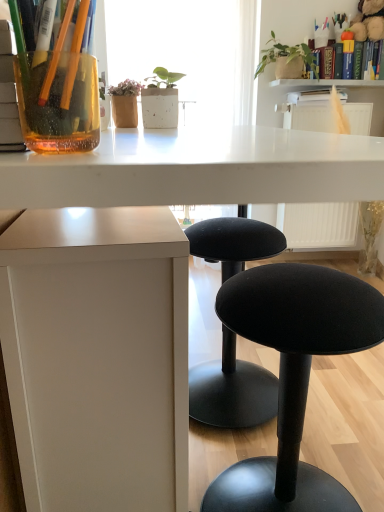
Question: Should I look upward or downward to see hardcover book at upper right, the 2th book positioned from the bottom?

Choices:
 (A) up
 (B) down

Answer: (A)

Question: From the image's perspective, is white plastic radiator at upper right on green matte plant at upper right?

Choices:
 (A) yes
 (B) no

Answer: (B)

Question: Does white plastic radiator at upper right have a larger size compared to green matte plant at upper right?

Choices:
 (A) yes
 (B) no

Answer: (A)

Question: Is white plastic radiator at upper right smaller than green matte plant at upper right?

Choices:
 (A) no
 (B) yes

Answer: (A)

Question: Is white plastic radiator at upper right not near green matte plant at upper right?

Choices:
 (A) yes
 (B) no

Answer: (B)

Question: Is white plastic radiator at upper right located outside green matte plant at upper right?

Choices:
 (A) no
 (B) yes

Answer: (B)

Question: Can you confirm if white plastic radiator at upper right is wider than green matte plant at upper right?

Choices:
 (A) no
 (B) yes

Answer: (B)

Question: Does white textured shelf at upper center have a greater width compared to green matte plant at upper right?

Choices:
 (A) no
 (B) yes

Answer: (A)

Question: Is the surface of white textured shelf at upper center in direct contact with green matte plant at upper right?

Choices:
 (A) no
 (B) yes

Answer: (A)

Question: Is white textured shelf at upper center outside of green matte plant at upper right?

Choices:
 (A) yes
 (B) no

Answer: (A)

Question: Is white textured shelf at upper center shorter than green matte plant at upper right?

Choices:
 (A) yes
 (B) no

Answer: (A)

Question: Is white textured shelf at upper center positioned in front of green matte plant at upper right?

Choices:
 (A) yes
 (B) no

Answer: (B)

Question: Is white textured shelf at upper center at the left side of green matte plant at upper right?

Choices:
 (A) no
 (B) yes

Answer: (A)

Question: Considering the relative sizes of white plastic radiator at upper right and hardcover book at upper right, the first book from the right, in the image provided, is white plastic radiator at upper right smaller than hardcover book at upper right, the first book from the right,?

Choices:
 (A) yes
 (B) no

Answer: (B)